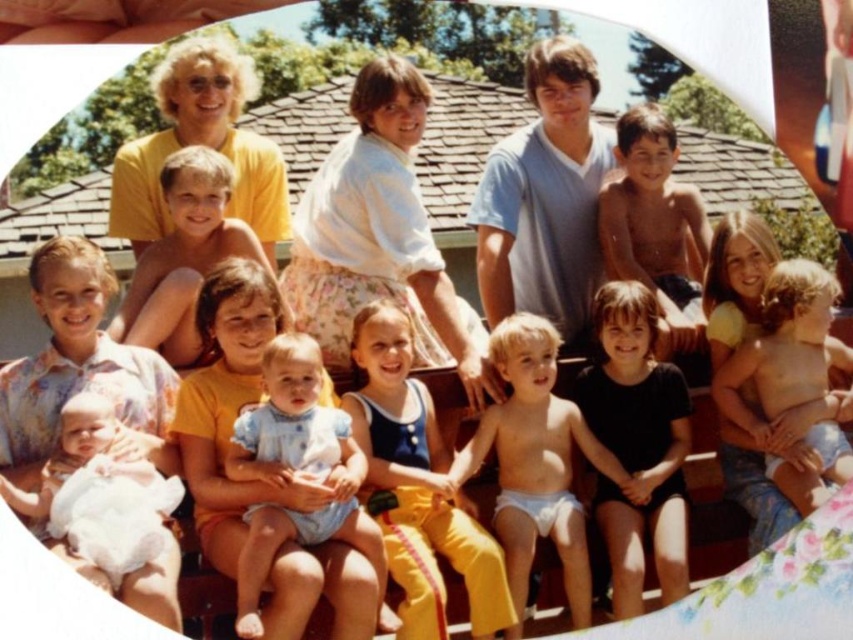
Based on the photo, can you confirm if black matte shirt at center is positioned to the left of light blue fabric at center?

Incorrect, black matte shirt at center is not on the left side of light blue fabric at center.

Does point (688, 412) come behind point (299, 451)?

That is True.

The height and width of the screenshot is (640, 853). Find the location of `black matte shirt at center`. black matte shirt at center is located at coordinates (637, 444).

Can you confirm if white soft fabric baby at lower left is bigger than shiny brown hair at upper right?

Yes, white soft fabric baby at lower left is bigger than shiny brown hair at upper right.

Which is in front, point (132, 461) or point (672, 291)?

Point (132, 461) is more forward.

You are a GUI agent. You are given a task and a screenshot of the screen. Output one action in this format:
    pyautogui.click(x=<x>, y=<y>)
    Task: Click on the white soft fabric baby at lower left
    
    Given the screenshot: What is the action you would take?
    pyautogui.click(x=109, y=512)

Which is behind, point (375, 496) or point (134, 292)?

Positioned behind is point (375, 496).

Can you confirm if blue cotton tank top at center is positioned above light brown hair at center?

Actually, blue cotton tank top at center is below light brown hair at center.

The height and width of the screenshot is (640, 853). I want to click on blue cotton tank top at center, so click(416, 486).

At what (x,y) coordinates should I click in order to perform the action: click on blue cotton tank top at center. Please return your answer as a coordinate pair (x, y). Looking at the image, I should click on (416, 486).